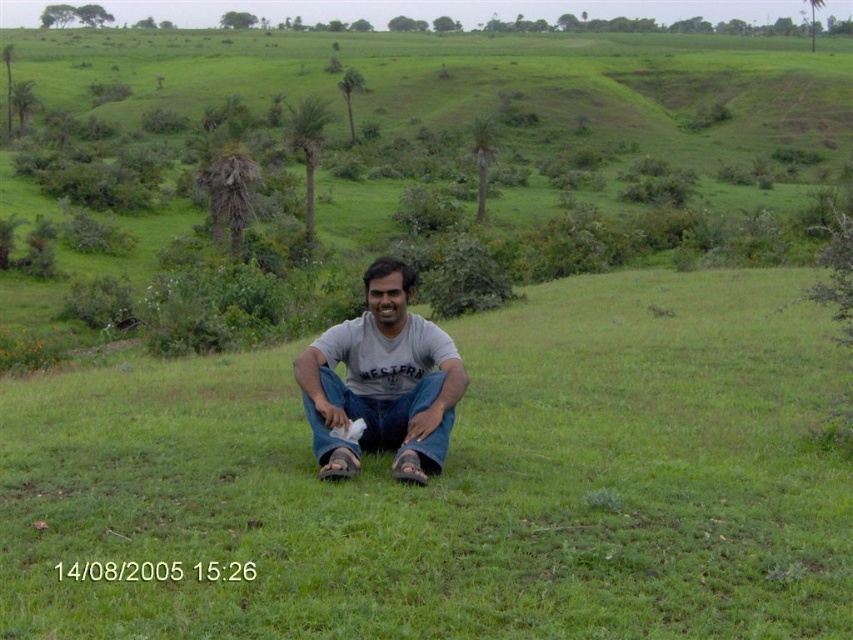
Question: Considering the real-world distances, which object is closest to the green grassy at center?

Choices:
 (A) jeans at center
 (B) gray cotton shirt at center

Answer: (A)

Question: Can you confirm if green grassy at center is positioned to the right of jeans at center?

Choices:
 (A) yes
 (B) no

Answer: (A)

Question: Which of the following is the closest to the observer?

Choices:
 (A) gray cotton shirt at center
 (B) jeans at center
 (C) green grassy at center

Answer: (C)

Question: Where is green grassy at center located in relation to gray cotton shirt at center in the image?

Choices:
 (A) above
 (B) below

Answer: (B)

Question: Which point is closer to the camera taking this photo?

Choices:
 (A) (584, 372)
 (B) (399, 413)
 (C) (323, 408)

Answer: (C)

Question: Where is green grassy at center located in relation to jeans at center in the image?

Choices:
 (A) below
 (B) above

Answer: (B)